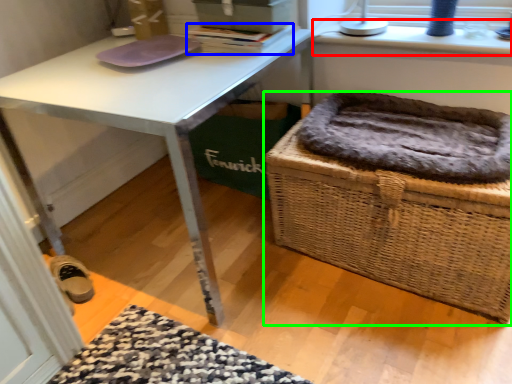
Question: Which is farther away from window sill (highlighted by a red box)? book (highlighted by a blue box) or picnic basket (highlighted by a green box)?

Choices:
 (A) book
 (B) picnic basket

Answer: (B)